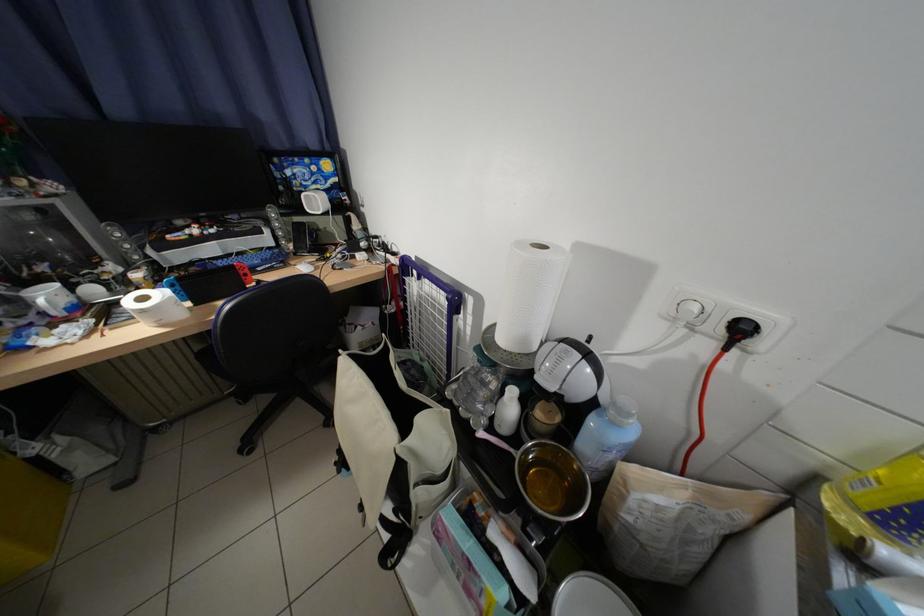
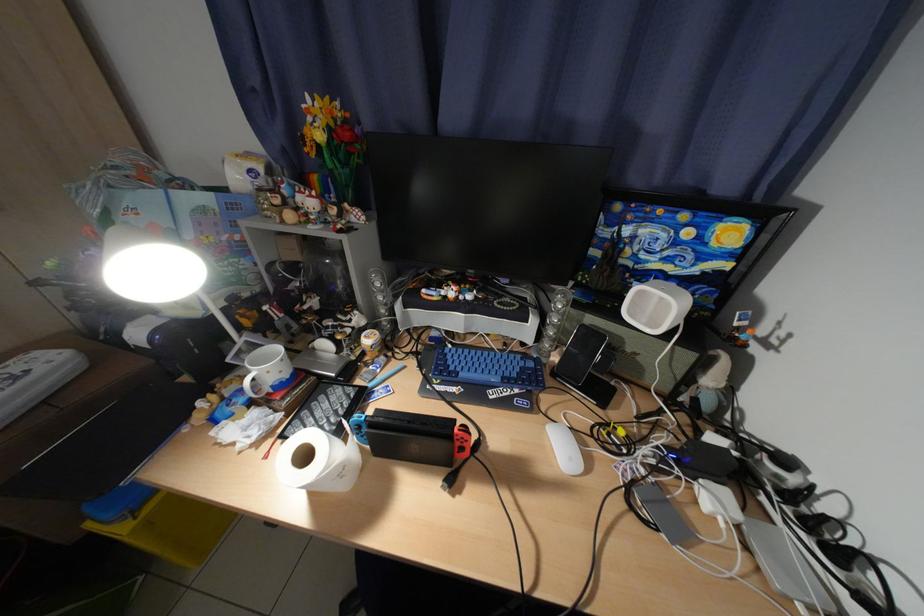
Locate, in the second image, the point that corresponds to (299,174) in the first image.

(638, 233)